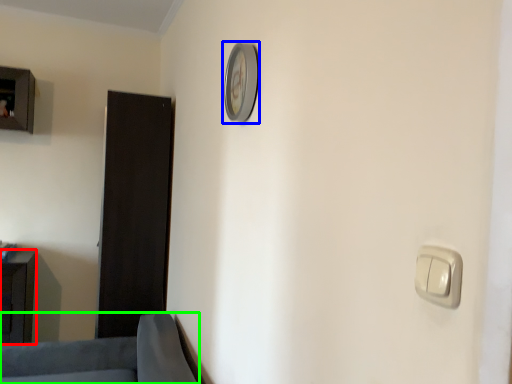
Question: Which object is positioned farthest from furniture (highlighted by a red box)? Select from clock (highlighted by a blue box) and furniture (highlighted by a green box).

Choices:
 (A) clock
 (B) furniture

Answer: (A)